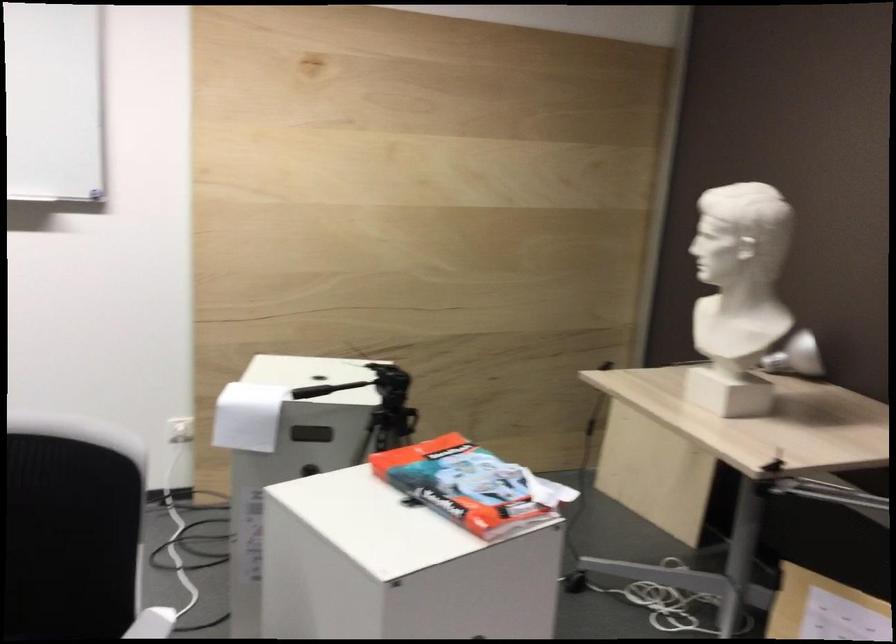
At what (x,y) coordinates should I click in order to perform the action: click on white sheet of paper. Please return your answer as a coordinate pair (x, y). Looking at the image, I should click on (247, 415).